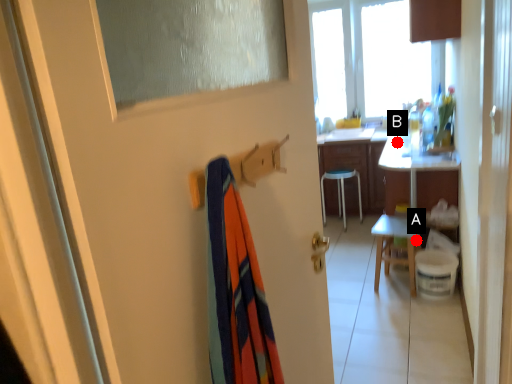
Question: Two points are circled on the image, labeled by A and B beside each circle. Which point is closer to the camera taking this photo?

Choices:
 (A) A is closer
 (B) B is closer

Answer: (A)